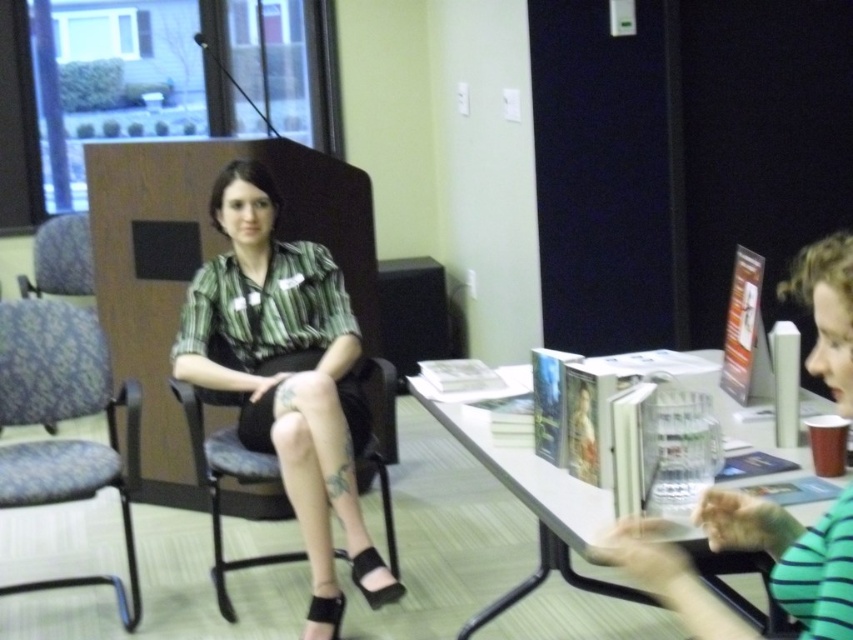
Is matte green shirt at center smaller than green striped shirt at right?

Incorrect, matte green shirt at center is not smaller in size than green striped shirt at right.

Is matte green shirt at center positioned before green striped shirt at right?

No, matte green shirt at center is behind green striped shirt at right.

Does point (215, 179) lie behind point (811, 621)?

Yes.

The width and height of the screenshot is (853, 640). What are the coordinates of `matte green shirt at center` in the screenshot? It's located at click(287, 378).

Does matte green shirt at center appear on the left side of blue fabric swivel chair at left?

Incorrect, matte green shirt at center is not on the left side of blue fabric swivel chair at left.

What do you see at coordinates (287, 378) in the screenshot?
I see `matte green shirt at center` at bounding box center [287, 378].

At what (x,y) coordinates should I click in order to perform the action: click on matte green shirt at center. Please return your answer as a coordinate pair (x, y). Image resolution: width=853 pixels, height=640 pixels. Looking at the image, I should click on (287, 378).

Can you confirm if blue fabric swivel chair at left is shorter than white glossy table at center?

No.

At what (x,y) coordinates should I click in order to perform the action: click on blue fabric swivel chair at left. Please return your answer as a coordinate pair (x, y). The width and height of the screenshot is (853, 640). Looking at the image, I should click on (62, 419).